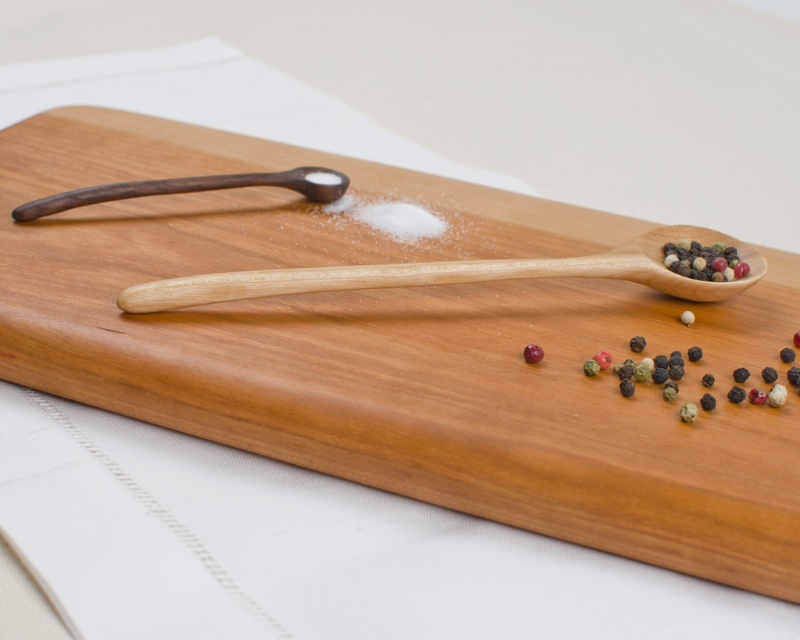
Can you confirm if multicolored peppercorns at right is smaller than glossy red pepper at center?

No.

Is multicolored peppercorns at right bigger than glossy red pepper at center?

Correct, multicolored peppercorns at right is larger in size than glossy red pepper at center.

Image resolution: width=800 pixels, height=640 pixels. Find the location of `multicolored peppercorns at right`. multicolored peppercorns at right is located at coordinates (704, 260).

Between dark wood spoon at upper left and multicolored peppercorns at right, which one has less height?

multicolored peppercorns at right

Does dark wood spoon at upper left have a lesser height compared to multicolored peppercorns at right?

No.

Which is behind, point (110, 189) or point (684, 266)?

The point (110, 189) is behind.

The height and width of the screenshot is (640, 800). Find the location of `dark wood spoon at upper left`. dark wood spoon at upper left is located at coordinates (192, 188).

Is point (660, 244) less distant than point (708, 269)?

No, (660, 244) is behind (708, 269).

Can you confirm if light wood spoon at center is positioned to the right of multicolored peppercorns at right?

Incorrect, light wood spoon at center is not on the right side of multicolored peppercorns at right.

Is point (456, 275) closer to camera compared to point (680, 262)?

That is True.

Locate an element on the screen. Image resolution: width=800 pixels, height=640 pixels. light wood spoon at center is located at coordinates (454, 275).